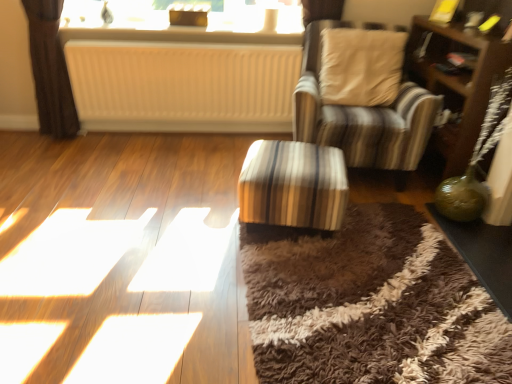
At what (x,y) coordinates should I click in order to perform the action: click on vacant space underneath white ribbed radiator at center (from a real-world perspective). Please return your answer as a coordinate pair (x, y). The width and height of the screenshot is (512, 384). Looking at the image, I should click on (188, 129).